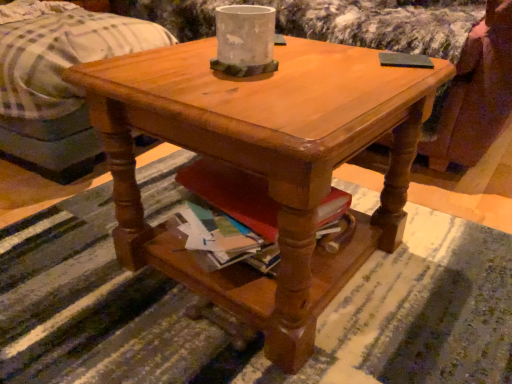
Measure the distance between white cotton bed at upper left and camera.

They are 1.12 meters apart.

This screenshot has width=512, height=384. What do you see at coordinates (264, 164) in the screenshot? I see `matte wood coffee table at center` at bounding box center [264, 164].

The image size is (512, 384). I want to click on white cotton bed at upper left, so click(x=59, y=86).

Is white cotton bed at upper left facing towards matte wood coffee table at center?

No, white cotton bed at upper left is not aimed at matte wood coffee table at center.

Is white cotton bed at upper left outside of matte wood coffee table at center?

Yes.

From the image's perspective, is white cotton bed at upper left positioned above or below matte wood coffee table at center?

From the image's perspective, white cotton bed at upper left appears above matte wood coffee table at center.

Is white cotton bed at upper left in front of or behind matte wood coffee table at center in the image?

white cotton bed at upper left is behind matte wood coffee table at center.

In order to click on candle holder behind the matte wood coffee table at center in this screenshot , I will do `click(244, 40)`.

Is white concrete vase at center next to matte wood coffee table at center and touching it?

No.

Looking at this image, in terms of height, does white concrete vase at center look taller or shorter compared to matte wood coffee table at center?

Clearly, white concrete vase at center is shorter compared to matte wood coffee table at center.

Is white concrete vase at center located outside matte wood coffee table at center?

white concrete vase at center is positioned outside matte wood coffee table at center.

Which is more to the right, matte wood coffee table at center or white concrete vase at center?

matte wood coffee table at center.

Which of these two, matte wood coffee table at center or white concrete vase at center, stands taller?

With more height is matte wood coffee table at center.

Would you say matte wood coffee table at center is inside or outside white concrete vase at center?

matte wood coffee table at center is located beyond the bounds of white concrete vase at center.

Which object is closer to the camera taking this photo, matte wood coffee table at center or white concrete vase at center?

Positioned in front is matte wood coffee table at center.

Which is nearer, (16, 56) or (236, 51)?

Positioned in front is point (236, 51).

Is white cotton bed at upper left far away from white concrete vase at center?

They are positioned close to each other.

Do you think white cotton bed at upper left is within white concrete vase at center, or outside of it?

white cotton bed at upper left is not enclosed by white concrete vase at center.

From the image's perspective, is white cotton bed at upper left located above or below white concrete vase at center?

Clearly, from the image's perspective, white cotton bed at upper left is above white concrete vase at center.

Identify the location of candle holder on the right of white cotton bed at upper left. The image size is (512, 384). (244, 40).

Is white concrete vase at center positioned far away from white cotton bed at upper left?

Actually, white concrete vase at center and white cotton bed at upper left are a little close together.

Could you tell me if white concrete vase at center is facing white cotton bed at upper left?

No, white concrete vase at center is not turned towards white cotton bed at upper left.

What's the angular difference between white concrete vase at center and white cotton bed at upper left's facing directions?

They differ by 9.48 degrees in their facing directions.

At what (x,y) coordinates should I click in order to perform the action: click on bed behind the matte wood coffee table at center. Please return your answer as a coordinate pair (x, y). This screenshot has width=512, height=384. Looking at the image, I should click on (59, 86).

Does point (127, 220) lie in front of point (49, 123)?

That is True.

Which of these two, matte wood coffee table at center or white cotton bed at upper left, stands shorter?

matte wood coffee table at center.

This screenshot has height=384, width=512. In order to click on coffee table above the white cotton bed at upper left (from a real-world perspective) in this screenshot , I will do `click(264, 164)`.

Find the location of a particular element. The image size is (512, 384). candle holder behind the matte wood coffee table at center is located at coordinates (244, 40).

Based on their spatial positions, is matte wood coffee table at center or white concrete vase at center further from white cotton bed at upper left?

white concrete vase at center.

Looking at the image, which one is located further to matte wood coffee table at center, white concrete vase at center or white cotton bed at upper left?

white cotton bed at upper left.

Based on their spatial positions, is white concrete vase at center or matte wood coffee table at center further from white cotton bed at upper left?

Based on the image, white concrete vase at center appears to be further to white cotton bed at upper left.

Based on their spatial positions, is white cotton bed at upper left or matte wood coffee table at center closer to white concrete vase at center?

matte wood coffee table at center is closer to white concrete vase at center.

Based on their spatial positions, is white cotton bed at upper left or white concrete vase at center closer to matte wood coffee table at center?

white concrete vase at center is closer to matte wood coffee table at center.

Based on their spatial positions, is matte wood coffee table at center or white cotton bed at upper left closer to white concrete vase at center?

matte wood coffee table at center is positioned closer to the anchor white concrete vase at center.

This screenshot has height=384, width=512. I want to click on candle holder between white cotton bed at upper left and matte wood coffee table at center from left to right, so click(244, 40).